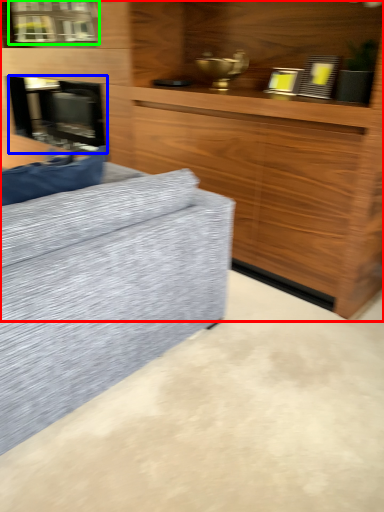
Question: Which object is the farthest from cabinetry (highlighted by a red box)? Choose among these: fireplace (highlighted by a blue box) or window (highlighted by a green box).

Choices:
 (A) fireplace
 (B) window

Answer: (B)